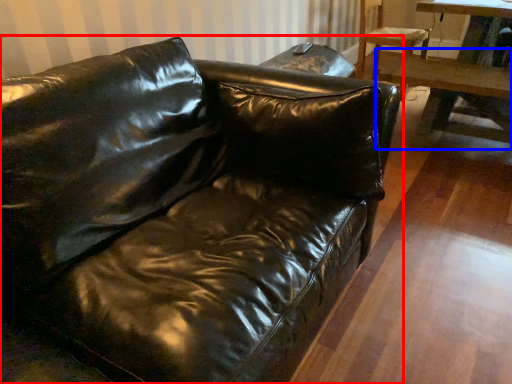
Question: Which point is closer to the camera, studio couch (highlighted by a red box) or table (highlighted by a blue box)?

Choices:
 (A) studio couch
 (B) table

Answer: (A)